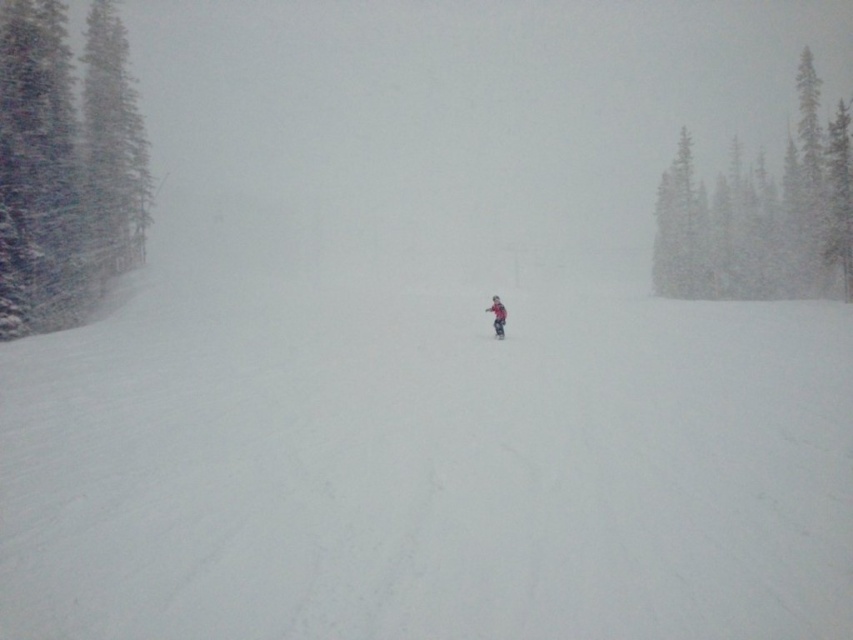
Question: Which object is farther from the camera taking this photo?

Choices:
 (A) red jacket at center
 (B) green textured pine trees at left

Answer: (A)

Question: Which point appears farthest from the camera in this image?

Choices:
 (A) (45, 104)
 (B) (498, 339)
 (C) (498, 332)
 (D) (502, 336)

Answer: (A)

Question: Is red jacket at center bigger than red matte ski at center?

Choices:
 (A) no
 (B) yes

Answer: (B)

Question: Does green textured pine trees at upper right have a larger size compared to red jacket at center?

Choices:
 (A) yes
 (B) no

Answer: (A)

Question: Based on their relative distances, which object is farther from the green textured pine trees at left?

Choices:
 (A) matte red ski at center
 (B) green textured pine trees at upper right
 (C) red matte ski at center

Answer: (B)

Question: Is red matte ski at center thinner than matte red ski at center?

Choices:
 (A) no
 (B) yes

Answer: (A)